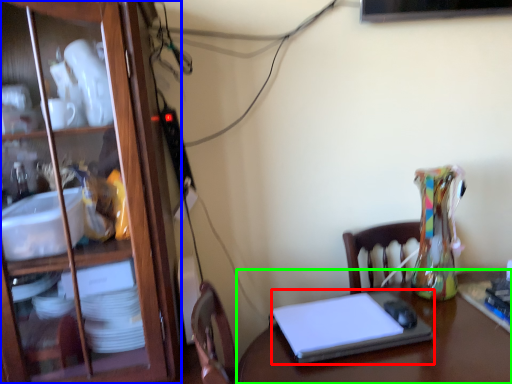
Question: Which object is the farthest from laptop (highlighted by a red box)? Choose among these: cabinetry (highlighted by a blue box) or desk (highlighted by a green box).

Choices:
 (A) cabinetry
 (B) desk

Answer: (A)